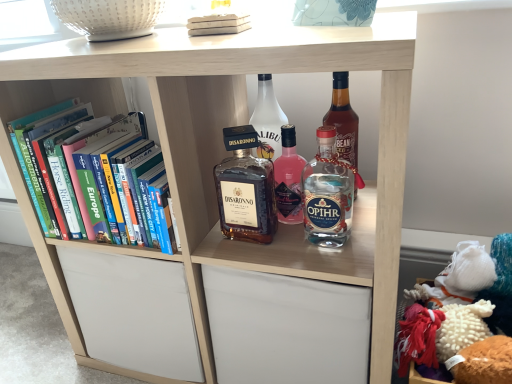
Locate an element on the screen. vacant space situated on the left part of white matte book at upper center, the 2th book in the bottom-to-top sequence is located at coordinates (141, 41).